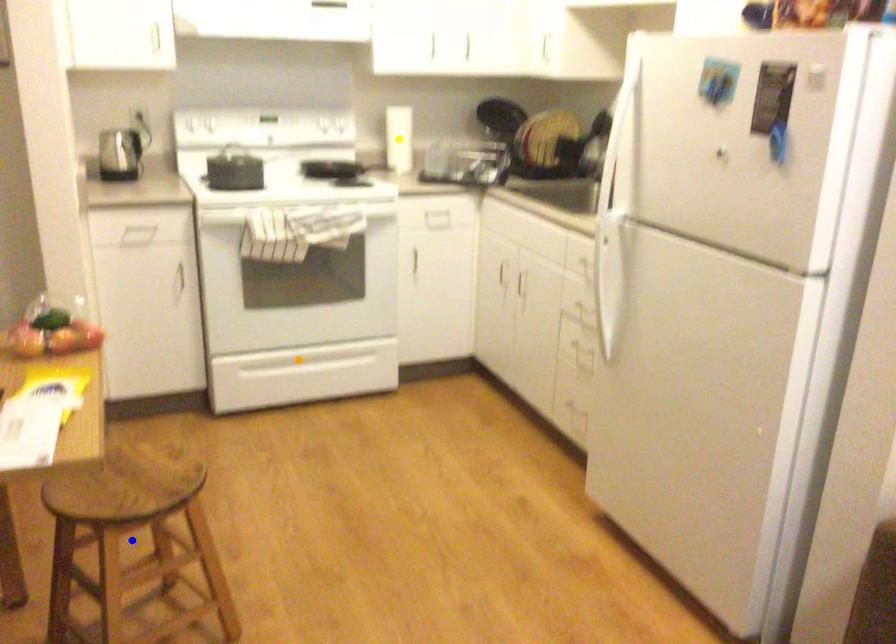
Order these from farthest to nearest:
A) blue point
B) orange point
C) yellow point

yellow point, orange point, blue point